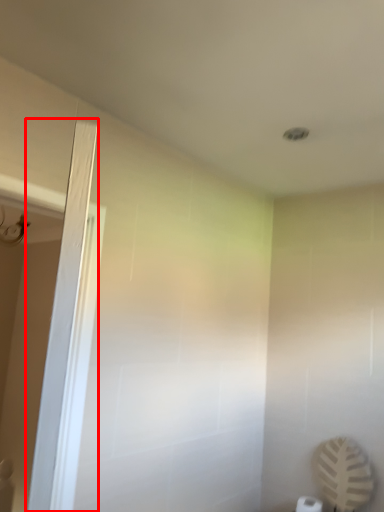
Question: From the image's perspective, where is screen door (annotated by the red box) located relative to toilet paper?

Choices:
 (A) below
 (B) above

Answer: (B)